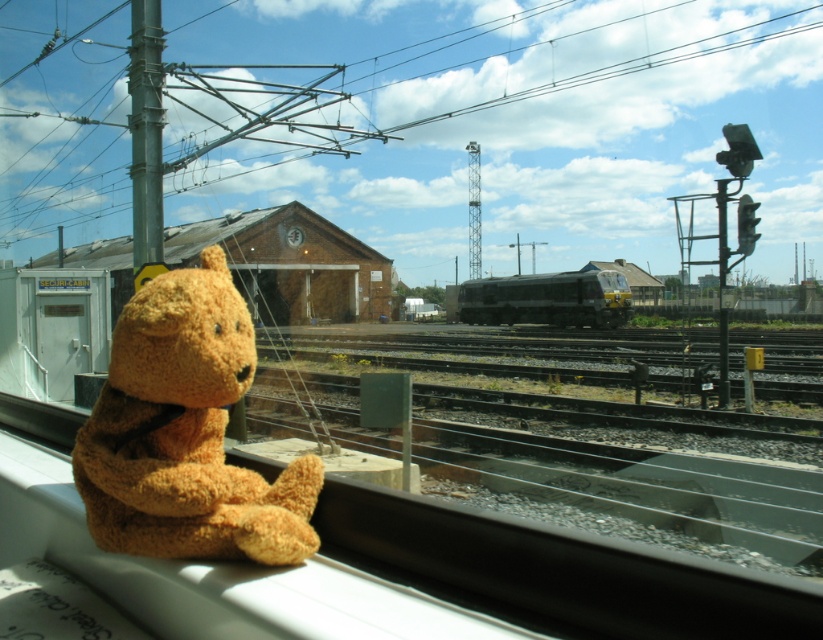
Question: Does fuzzy brown teddy bear at left appear under dark gray metallic train at center?

Choices:
 (A) no
 (B) yes

Answer: (B)

Question: Among these objects, which one is farthest from the camera?

Choices:
 (A) dark gray metallic train at center
 (B) fuzzy brown teddy bear at left

Answer: (A)

Question: Is fuzzy brown teddy bear at left behind dark gray metallic train at center?

Choices:
 (A) yes
 (B) no

Answer: (B)

Question: Which point is farther from the camera taking this photo?

Choices:
 (A) (207, 250)
 (B) (463, 310)

Answer: (B)

Question: Can you confirm if fuzzy brown teddy bear at left is smaller than dark gray metallic train at center?

Choices:
 (A) yes
 (B) no

Answer: (A)